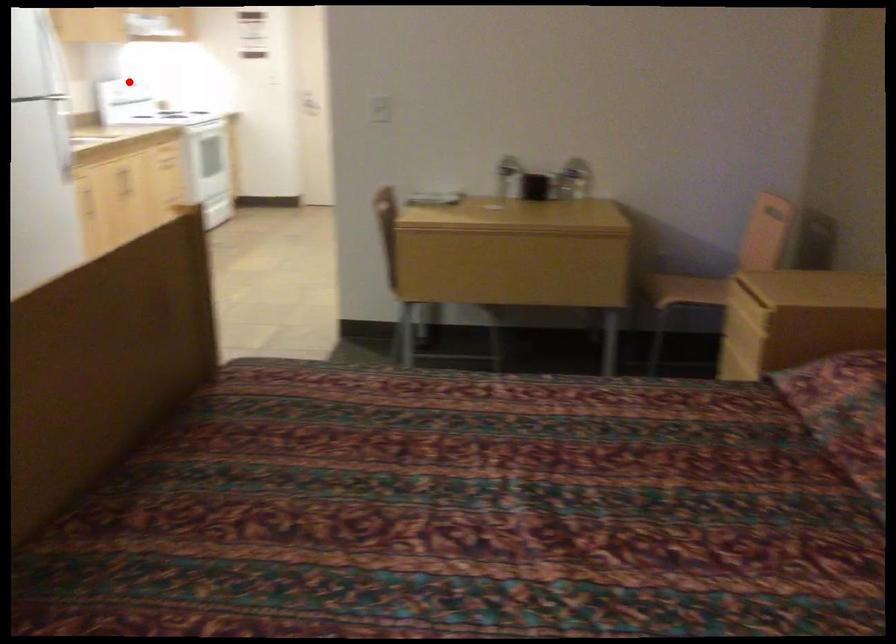
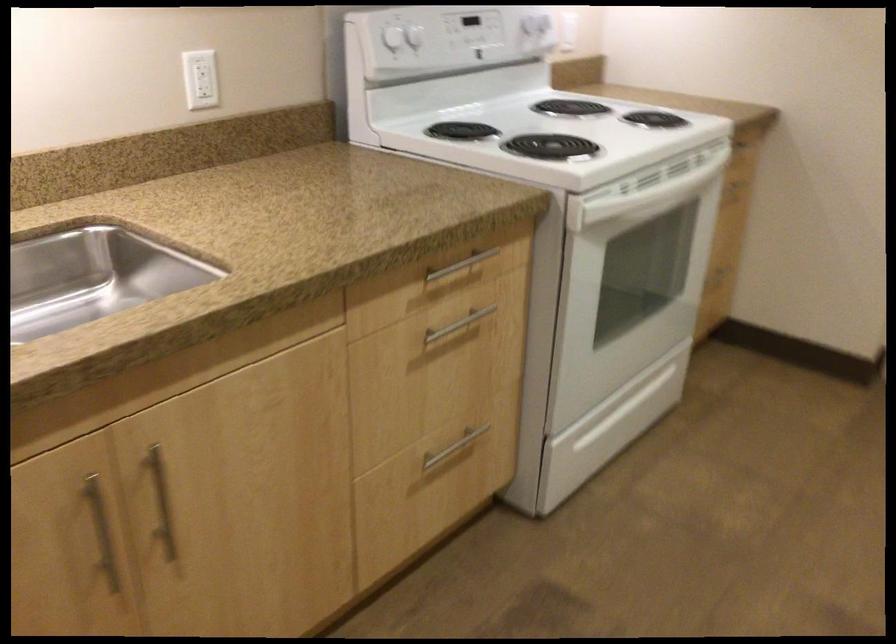
Question: I am providing you with two images of the same scene from different viewpoints. Given a red point in image1, look at the same physical point in image2. Is it:

Choices:
 (A) Closer to the viewpoint
 (B) Farther from the viewpoint

Answer: (A)